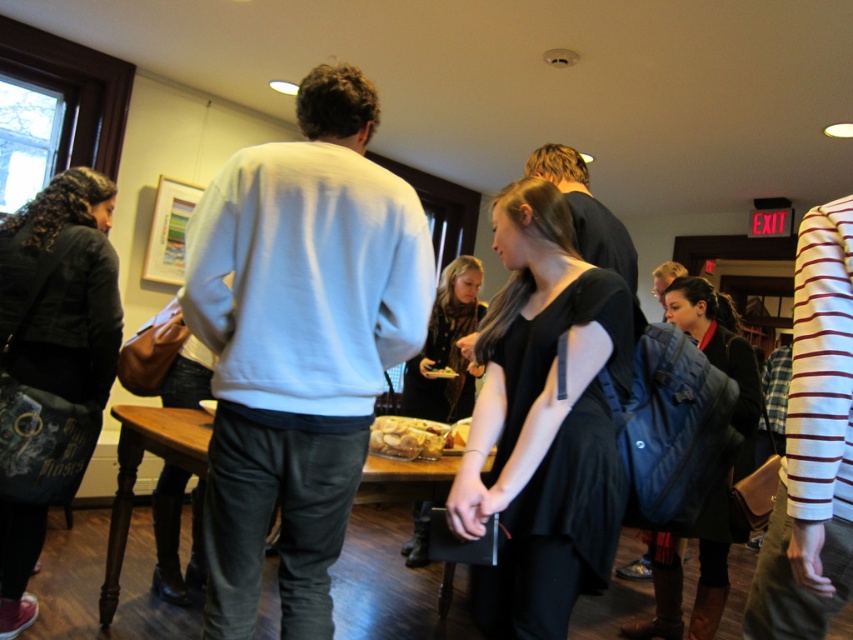
Can you confirm if white matte sweatshirt at center is positioned to the left of white striped shirt at right?

Yes, white matte sweatshirt at center is to the left of white striped shirt at right.

Is the position of white matte sweatshirt at center less distant than that of white striped shirt at right?

No, it is not.

Which is in front, point (358, 372) or point (779, 536)?

Positioned in front is point (779, 536).

Locate an element on the screen. white matte sweatshirt at center is located at coordinates (299, 344).

Is white matte sweatshirt at center to the left of black matte dress at center from the viewer's perspective?

Yes, white matte sweatshirt at center is to the left of black matte dress at center.

Is white matte sweatshirt at center above black matte dress at center?

Correct, white matte sweatshirt at center is located above black matte dress at center.

Who is more distant from viewer, (296, 100) or (602, 336)?

Point (296, 100)

The height and width of the screenshot is (640, 853). Identify the location of white matte sweatshirt at center. (299, 344).

Does dark green fabric jacket at left appear on the right side of wooden table at center?

Incorrect, dark green fabric jacket at left is not on the right side of wooden table at center.

Is dark green fabric jacket at left thinner than wooden table at center?

Yes, dark green fabric jacket at left is thinner than wooden table at center.

Which is behind, point (44, 241) or point (194, 458)?

Positioned behind is point (44, 241).

Find the location of a particular element. Image resolution: width=853 pixels, height=640 pixels. dark green fabric jacket at left is located at coordinates (51, 364).